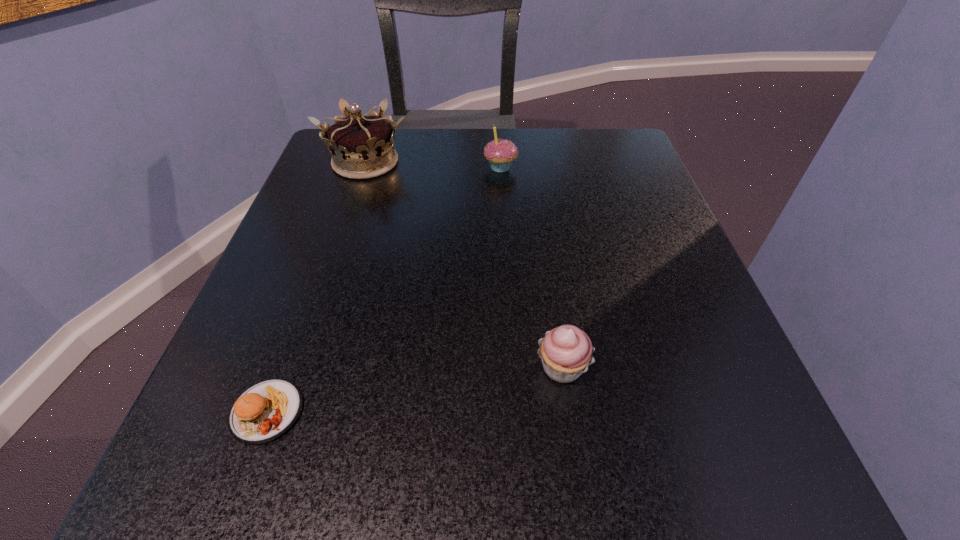
At what (x,y) coordinates should I click in order to perform the action: click on vacant space that's between the patty and the tallest object. Please return your answer as a coordinate pair (x, y). Looking at the image, I should click on (316, 287).

The height and width of the screenshot is (540, 960). In order to click on free space between the crown and the patty in this screenshot , I will do `click(316, 287)`.

The height and width of the screenshot is (540, 960). What are the coordinates of `free space between the second tallest object and the patty` in the screenshot? It's located at (384, 289).

Point out which object is positioned as the third nearest to the shorter cupcake. Please provide its 2D coordinates. Your answer should be formatted as a tuple, i.e. [(x, y)], where the tuple contains the x and y coordinates of a point satisfying the conditions above.

[(362, 147)]

Locate an element on the screen. The width and height of the screenshot is (960, 540). the closest object to the tallest object is located at coordinates (500, 153).

This screenshot has width=960, height=540. In order to click on vacant space that satisfies the following two spatial constraints: 1. on the back side of the shortest object; 2. on the left side of the crown in this screenshot , I will do `click(357, 162)`.

This screenshot has width=960, height=540. Identify the location of free location that satisfies the following two spatial constraints: 1. on the back side of the farther cupcake; 2. on the right side of the shortest object. (355, 167).